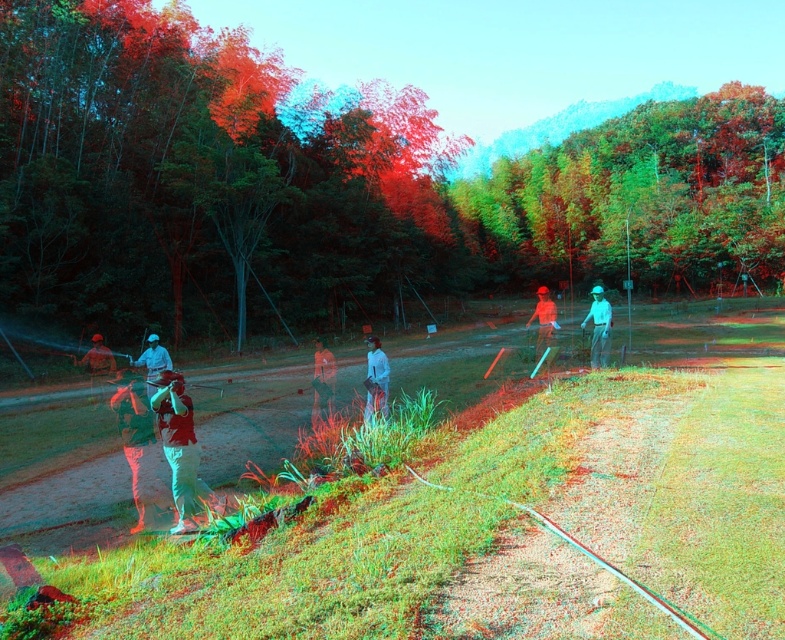
Question: Does green matte tree at upper center appear over white cotton shirt at center?

Choices:
 (A) no
 (B) yes

Answer: (B)

Question: Does light gray fabric shirt at center appear on the left side of matte green shirt at left?

Choices:
 (A) yes
 (B) no

Answer: (B)

Question: Which object is the closest to the green leafy tree at center?

Choices:
 (A) camouflage fabric jacket at center
 (B) green matte tree at upper center
 (C) light blue fabric shirt at center

Answer: (B)

Question: From the image, what is the correct spatial relationship of green leafy tree at center in relation to light blue fabric shirt at center?

Choices:
 (A) above
 (B) below

Answer: (A)

Question: Which is farther from the white cotton shirt at center?

Choices:
 (A) light gray fabric shirt at center
 (B) green leafy tree at center

Answer: (B)

Question: Considering the real-world distances, which object is farthest from the white matte shirt at center?

Choices:
 (A) matte green shirt at left
 (B) green leafy tree at center
 (C) matte orange shirt at center

Answer: (B)